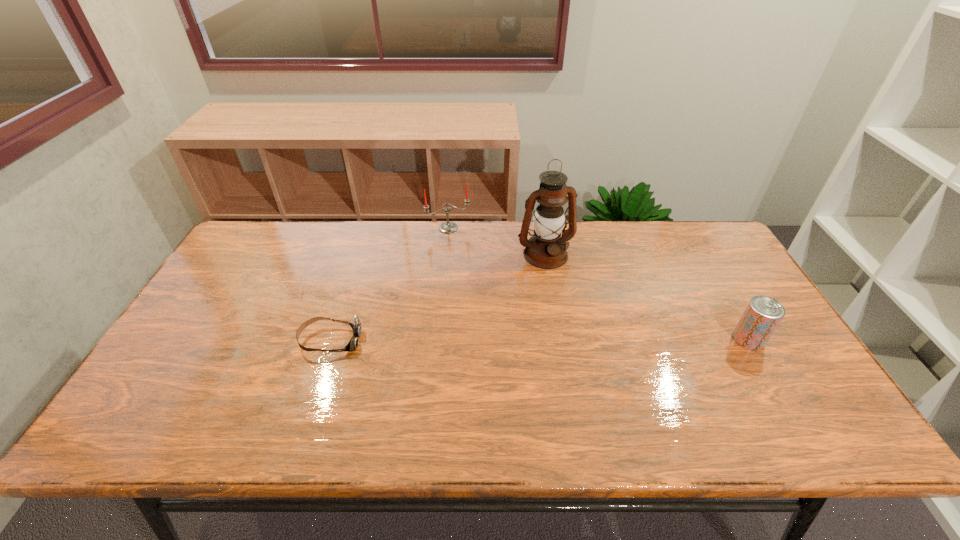
Identify the location of goggles. The image size is (960, 540). (356, 326).

The height and width of the screenshot is (540, 960). In order to click on the leftmost object in this screenshot , I will do `click(356, 326)`.

Where is `beer can`? The height and width of the screenshot is (540, 960). beer can is located at coordinates (763, 314).

Locate an element on the screen. the rightmost object is located at coordinates (763, 314).

The height and width of the screenshot is (540, 960). I want to click on lantern, so click(x=546, y=249).

Where is `the third nearest object`? This screenshot has width=960, height=540. the third nearest object is located at coordinates (546, 249).

Image resolution: width=960 pixels, height=540 pixels. In order to click on candle in this screenshot , I will do `click(447, 227)`.

You are a GUI agent. You are given a task and a screenshot of the screen. Output one action in this format:
    pyautogui.click(x=<x>, y=<y>)
    Task: Click on the third shortest object
    The height and width of the screenshot is (540, 960).
    Given the screenshot: What is the action you would take?
    pyautogui.click(x=447, y=227)

The height and width of the screenshot is (540, 960). In order to click on vacant area situated 0.100m on the front-facing side of the shortest object in this screenshot , I will do `click(397, 341)`.

Identify the location of vacant area located 0.180m on the back of the second shortest object. (715, 283).